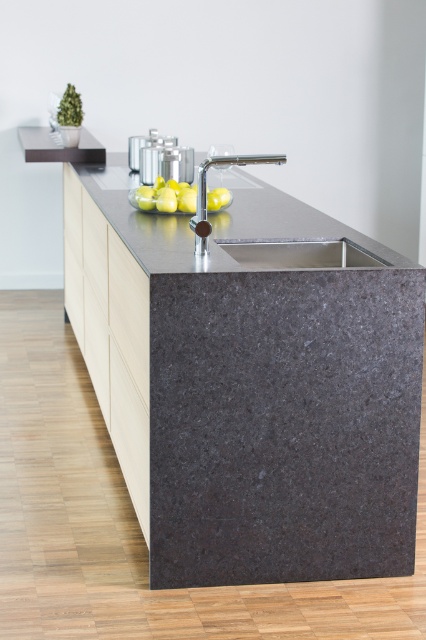
Is white glossy sink at center further to camera compared to yellow matte lemon at center?

No, white glossy sink at center is closer to the viewer.

Which is behind, point (322, 259) or point (189, 186)?

The point (189, 186) is behind.

At what (x,y) coordinates should I click in order to perform the action: click on white glossy sink at center. Please return your answer as a coordinate pair (x, y). Looking at the image, I should click on (299, 253).